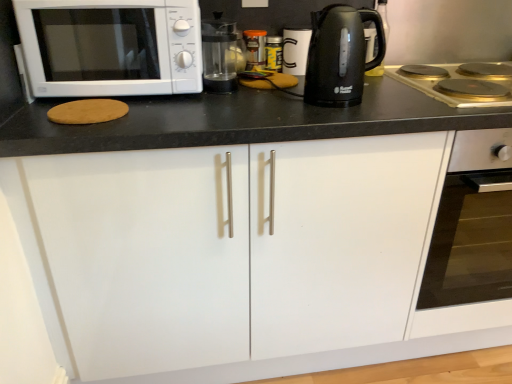
What are the coordinates of `free spot in front of black glossy electric kettle at upper right` in the screenshot? It's located at (351, 115).